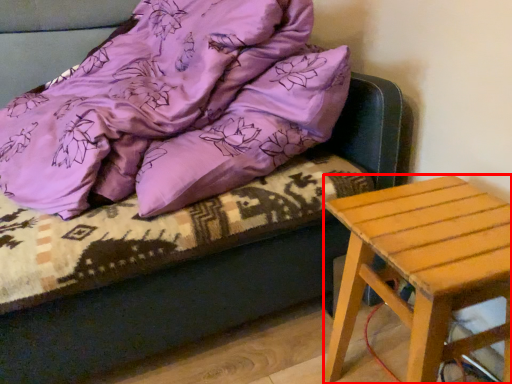
Question: Considering the relative positions of stool (annotated by the red box) and blanket in the image provided, where is stool (annotated by the red box) located with respect to the staircase?

Choices:
 (A) left
 (B) right

Answer: (B)